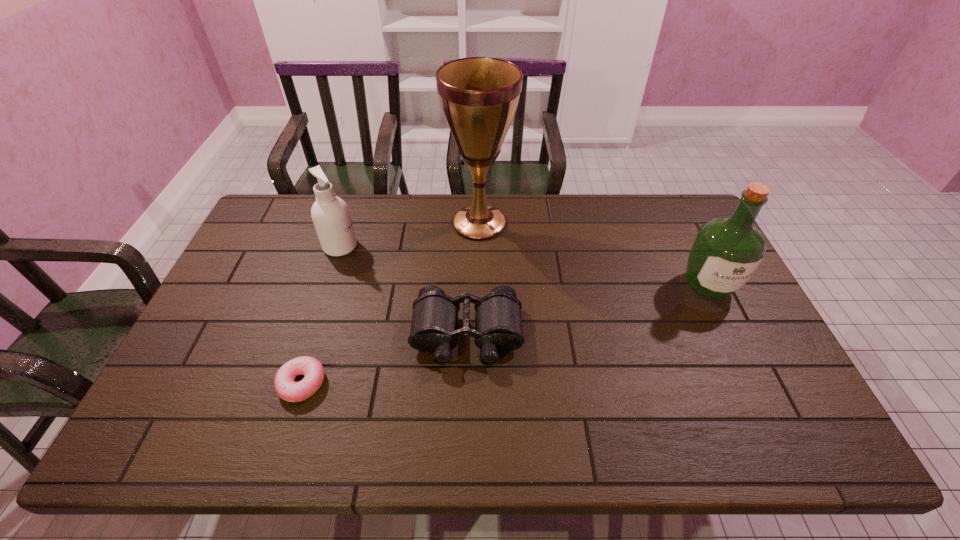
The height and width of the screenshot is (540, 960). Find the location of `vacant space located on the right of the shortest object`. vacant space located on the right of the shortest object is located at coordinates (386, 383).

The height and width of the screenshot is (540, 960). What are the coordinates of `trophy cup at the far edge` in the screenshot? It's located at (479, 96).

Identify the location of cleansing agent present at the far edge. (330, 214).

The height and width of the screenshot is (540, 960). In order to click on object that is positioned at the right edge in this screenshot , I will do `click(727, 251)`.

In the image, there is a desktop. At what (x,y) coordinates should I click in order to perform the action: click on free region at the far edge. Please return your answer as a coordinate pair (x, y). The image size is (960, 540). Looking at the image, I should click on (553, 209).

Image resolution: width=960 pixels, height=540 pixels. In the image, there is a desktop. Identify the location of free space at the near edge. (541, 440).

Identify the location of free space at the left edge of the desktop. (228, 378).

The height and width of the screenshot is (540, 960). Identify the location of vacant region at the right edge of the desktop. (799, 415).

The width and height of the screenshot is (960, 540). In the image, there is a desktop. In order to click on vacant space at the far left corner in this screenshot , I will do `click(262, 235)`.

Locate an element on the screen. empty space that is in between the third tallest object and the second tallest object is located at coordinates [524, 266].